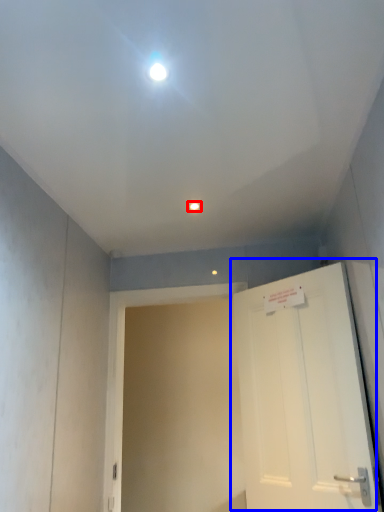
Question: Which object appears farthest to the camera in this image, light fixture (highlighted by a red box) or door (highlighted by a blue box)?

Choices:
 (A) light fixture
 (B) door

Answer: (A)